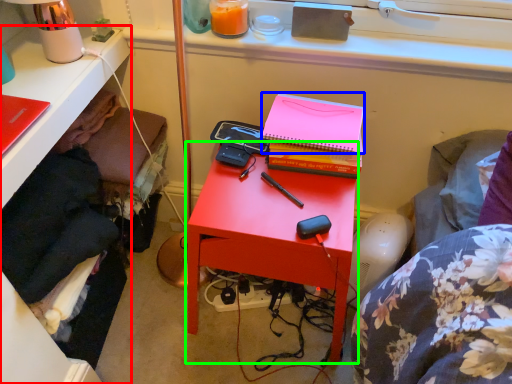
Question: Which object is positioned farthest from desk (highlighted by a red box)? Select from paperback book (highlighted by a blue box) and nightstand (highlighted by a green box).

Choices:
 (A) paperback book
 (B) nightstand

Answer: (A)